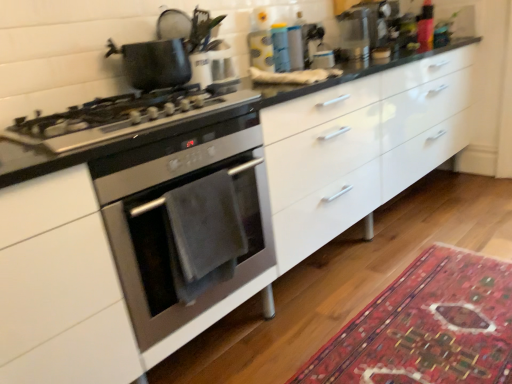
The image size is (512, 384). Find the location of `satin silver gas stove at left`. satin silver gas stove at left is located at coordinates (119, 117).

You are a GUI agent. You are given a task and a screenshot of the screen. Output one action in this format:
    pyautogui.click(x=<x>, y=<y>)
    Task: Click on the stainless steel oven at left
    The image size is (512, 384).
    Given the screenshot: What is the action you would take?
    pyautogui.click(x=170, y=225)

You are a GUI agent. You are given a task and a screenshot of the screen. Output one action in this format:
    pyautogui.click(x=<x>, y=<y>)
    Task: Click on the satin silver gas stove at left
    This screenshot has width=512, height=384.
    Given the screenshot: What is the action you would take?
    pyautogui.click(x=119, y=117)

From the image's perspective, is carpet with intricate patterns at lower right located above stainless steel oven at left?

No, from the image's perspective, carpet with intricate patterns at lower right is not on top of stainless steel oven at left.

The height and width of the screenshot is (384, 512). I want to click on oven above the carpet with intricate patterns at lower right (from a real-world perspective), so click(x=170, y=225).

Is point (498, 340) closer to viewer compared to point (273, 264)?

Yes, it is in front of point (273, 264).

How much distance is there between carpet with intricate patterns at lower right and stainless steel oven at left?

The distance of carpet with intricate patterns at lower right from stainless steel oven at left is 25.90 inches.

Based on the photo, could you tell me if matte black pot at upper left is facing stainless steel oven at left?

No, matte black pot at upper left is not oriented towards stainless steel oven at left.

From the image's perspective, is matte black pot at upper left beneath stainless steel oven at left?

No, from the image's perspective, matte black pot at upper left is not below stainless steel oven at left.

Considering the relative sizes of matte black pot at upper left and stainless steel oven at left in the image provided, is matte black pot at upper left bigger than stainless steel oven at left?

No.

Can you confirm if matte black pot at upper left is positioned to the right of stainless steel oven at left?

In fact, matte black pot at upper left is to the left of stainless steel oven at left.

From the image's perspective, who appears lower, satin silver gas stove at left or matte black pot at upper left?

satin silver gas stove at left appears lower in the image.

Which of these two, satin silver gas stove at left or matte black pot at upper left, is wider?

Wider between the two is satin silver gas stove at left.

I want to click on gas stove in front of the matte black pot at upper left, so tap(119, 117).

Considering their positions, is carpet with intricate patterns at lower right located in front of or behind satin silver gas stove at left?

carpet with intricate patterns at lower right is positioned farther from the viewer than satin silver gas stove at left.

Considering the relative positions of carpet with intricate patterns at lower right and satin silver gas stove at left in the image provided, is carpet with intricate patterns at lower right to the left of satin silver gas stove at left from the viewer's perspective?

Incorrect, carpet with intricate patterns at lower right is not on the left side of satin silver gas stove at left.

Considering the positions of points (377, 334) and (35, 136), is point (377, 334) farther from camera compared to point (35, 136)?

Yes, point (377, 334) is farther from viewer.

Between carpet with intricate patterns at lower right and satin silver gas stove at left, which one has smaller width?

satin silver gas stove at left is thinner.

Is matte black pot at upper left beside satin silver gas stove at left?

No, matte black pot at upper left is not in contact with satin silver gas stove at left.

From the image's perspective, which one is positioned higher, matte black pot at upper left or satin silver gas stove at left?

matte black pot at upper left.

Consider the image. Is matte black pot at upper left aimed at satin silver gas stove at left?

No, matte black pot at upper left is not aimed at satin silver gas stove at left.

From a real-world perspective, is matte black pot at upper left above or below satin silver gas stove at left?

matte black pot at upper left is situated higher than satin silver gas stove at left in the real world.

Considering the relative positions of stainless steel oven at left and satin silver gas stove at left in the image provided, is stainless steel oven at left to the left of satin silver gas stove at left from the viewer's perspective?

In fact, stainless steel oven at left is to the right of satin silver gas stove at left.

Where is `gas stove on the left side of stainless steel oven at left`? The image size is (512, 384). gas stove on the left side of stainless steel oven at left is located at coordinates (119, 117).

Would you say stainless steel oven at left is outside satin silver gas stove at left?

Yes, stainless steel oven at left is outside of satin silver gas stove at left.

Is matte black pot at upper left aimed at carpet with intricate patterns at lower right?

No, matte black pot at upper left is not aimed at carpet with intricate patterns at lower right.

Between matte black pot at upper left and carpet with intricate patterns at lower right, which one appears on the right side from the viewer's perspective?

carpet with intricate patterns at lower right is more to the right.

Which of these two, matte black pot at upper left or carpet with intricate patterns at lower right, stands taller?

With more height is matte black pot at upper left.

The height and width of the screenshot is (384, 512). In order to click on mat that appears on the right of matte black pot at upper left in this screenshot , I will do `click(426, 327)`.

Locate an element on the screen. The height and width of the screenshot is (384, 512). oven lying on the left of carpet with intricate patterns at lower right is located at coordinates (170, 225).

The width and height of the screenshot is (512, 384). I want to click on kitchen appliance positioned vertically above the stainless steel oven at left (from a real-world perspective), so click(154, 64).

Looking at the image, which one is located further to satin silver gas stove at left, stainless steel oven at left or carpet with intricate patterns at lower right?

carpet with intricate patterns at lower right is positioned further to the anchor satin silver gas stove at left.

Estimate the real-world distances between objects in this image. Which object is further from satin silver gas stove at left, matte black pot at upper left or stainless steel oven at left?

stainless steel oven at left lies further to satin silver gas stove at left than the other object.

From the image, which object appears to be nearer to matte black pot at upper left, carpet with intricate patterns at lower right or stainless steel oven at left?

Among the two, stainless steel oven at left is located nearer to matte black pot at upper left.

Estimate the real-world distances between objects in this image. Which object is closer to carpet with intricate patterns at lower right, stainless steel oven at left or matte black pot at upper left?

Based on the image, stainless steel oven at left appears to be nearer to carpet with intricate patterns at lower right.

Based on their spatial positions, is matte black pot at upper left or stainless steel oven at left closer to carpet with intricate patterns at lower right?

stainless steel oven at left is positioned closer to the anchor carpet with intricate patterns at lower right.

Looking at the image, which one is located further to satin silver gas stove at left, carpet with intricate patterns at lower right or stainless steel oven at left?

carpet with intricate patterns at lower right is further to satin silver gas stove at left.

Based on their spatial positions, is carpet with intricate patterns at lower right or satin silver gas stove at left closer to matte black pot at upper left?

Among the two, satin silver gas stove at left is located nearer to matte black pot at upper left.

Estimate the real-world distances between objects in this image. Which object is closer to satin silver gas stove at left, matte black pot at upper left or carpet with intricate patterns at lower right?

Among the two, matte black pot at upper left is located nearer to satin silver gas stove at left.

Where is `kitchen appliance located between satin silver gas stove at left and carpet with intricate patterns at lower right in the left-right direction`? This screenshot has width=512, height=384. kitchen appliance located between satin silver gas stove at left and carpet with intricate patterns at lower right in the left-right direction is located at coordinates (154, 64).

Locate an element on the screen. gas stove between matte black pot at upper left and stainless steel oven at left from top to bottom is located at coordinates (119, 117).

Find the location of a particular element. This screenshot has height=384, width=512. oven between satin silver gas stove at left and carpet with intricate patterns at lower right in the horizontal direction is located at coordinates (170, 225).

Find the location of a particular element. This screenshot has height=384, width=512. oven between matte black pot at upper left and carpet with intricate patterns at lower right is located at coordinates (170, 225).